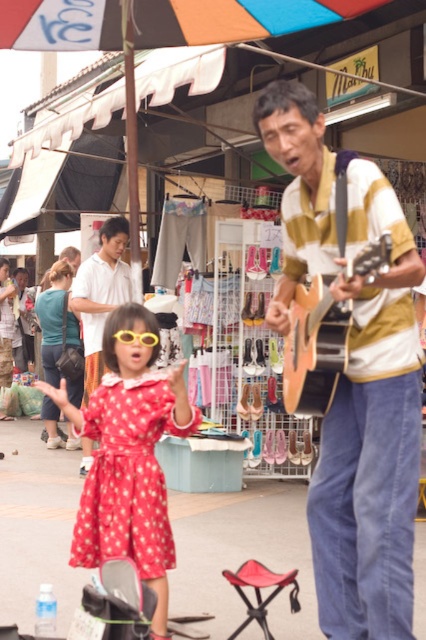
You are a photographer trying to capture a clear shot of the acoustic wood guitar at center and the matte white shirt at upper left. Which object should you adjust your focus on first to ensure it appears sharp in the photo?

The acoustic wood guitar at center should be focused on first because it is in front of the matte white shirt at upper left, making it closer to the camera.

You are a photographer trying to capture the girl in the red dress and the man with the guitar in the same frame. The girl is standing at the point with coordinates [354,376]. Where should you position your camera to ensure both subjects are in the shot?

The point [354,376] corresponds to the wooden acoustic guitar at center, so you should position your camera so that both the girl in the red dress and the wooden acoustic guitar at center are visible in the frame.

You are a photographer trying to capture both the polka dot fabric dress at lower left and the acoustic wood guitar at center in a single frame. Based on their positions, which object should you adjust your camera angle to focus on first to ensure both are in the shot?

The polka dot fabric dress at lower left is to the left of the acoustic wood guitar at center, so you should first focus on the polka dot fabric dress at lower left to ensure it is included in the frame before adjusting to include the acoustic wood guitar at center.